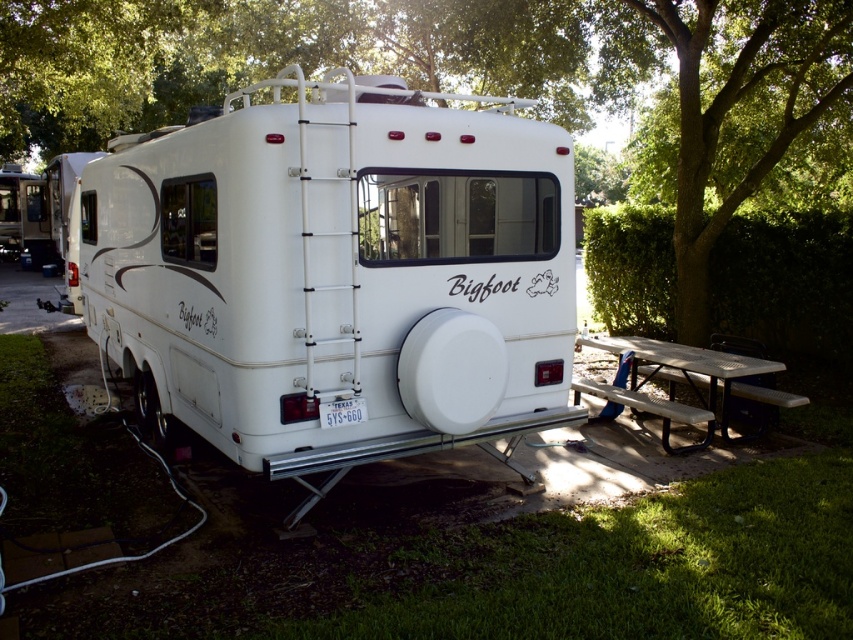
Question: Does green leafy tree at upper center have a smaller size compared to white plastic picnic table at lower right?

Choices:
 (A) no
 (B) yes

Answer: (A)

Question: In this image, where is white matte recreational vehicle at center located relative to green leafy tree at upper right?

Choices:
 (A) above
 (B) below

Answer: (B)

Question: Which point is closer to the camera?

Choices:
 (A) (537, 147)
 (B) (740, 362)

Answer: (A)

Question: Can you confirm if white matte recreational vehicle at center is smaller than green leafy tree at upper right?

Choices:
 (A) yes
 (B) no

Answer: (B)

Question: Which point is closer to the camera?

Choices:
 (A) (518, 400)
 (B) (811, 10)

Answer: (A)

Question: Which of the following is the closest to the observer?

Choices:
 (A) (469, 49)
 (B) (741, 108)

Answer: (B)